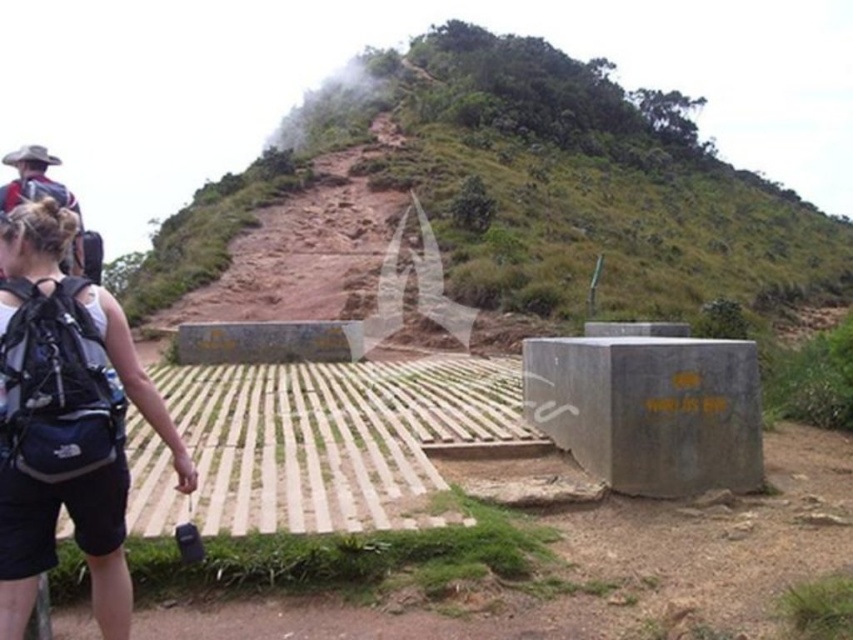
You are planning to place a small garden statue that is 1 meter tall on the brown dirt hillside at upper center. Based on the scene, will the statue be taller than the dark blue fabric backpack at lower left?

The brown dirt hillside at upper center is taller than the dark blue fabric backpack at lower left. However, the statue is only 1 meter tall, so it may not necessarily be taller than the backpack unless the backpack is shorter than 1 meter. The description does not provide the backpack height, so we cannot confirm.

You are planning to place a small garden on the brown dirt hillside at upper center and want to know if it can fit a dark blue fabric backpack at lower left. Can the hillside accommodate the backpack in terms of width?

The brown dirt hillside at upper center has a larger width than the dark blue fabric backpack at lower left, so the hillside can accommodate the backpack in terms of width.

You are planning to hike up the brown dirt hillside at upper center and need to know if your dark blue fabric backpack at lower left will fit in your car trunk. Can you determine this based on the scene?

The brown dirt hillside at upper center has a larger size compared to dark blue fabric backpack at lower left, so the backpack is smaller and should fit in the car trunk.